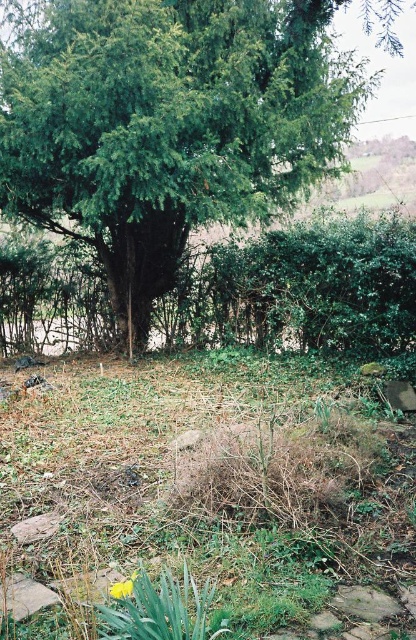
Who is positioned more to the left, green leafy hedge at center or yellow matte flower at lower center?

From the viewer's perspective, yellow matte flower at lower center appears more on the left side.

Is green leafy hedge at center bigger than yellow matte flower at lower center?

Indeed, green leafy hedge at center has a larger size compared to yellow matte flower at lower center.

The image size is (416, 640). I want to click on green leafy hedge at center, so click(x=321, y=284).

Between green grass at center and yellow matte flower at lower center, which one has more height?

With more height is green grass at center.

Is green grass at center in front of yellow matte flower at lower center?

No, it is behind yellow matte flower at lower center.

The image size is (416, 640). Describe the element at coordinates (210, 493) in the screenshot. I see `green grass at center` at that location.

Locate an element on the screen. The width and height of the screenshot is (416, 640). green grass at center is located at coordinates (210, 493).

Between point (153, 188) and point (245, 330), which one is positioned behind?

Positioned behind is point (245, 330).

Between green leafy tree at center and green leafy hedge at center, which one appears on the left side from the viewer's perspective?

From the viewer's perspective, green leafy tree at center appears more on the left side.

Who is more distant from viewer, (141, 275) or (343, 310)?

Point (141, 275)

Image resolution: width=416 pixels, height=640 pixels. Identify the location of green leafy tree at center. [x=165, y=124].